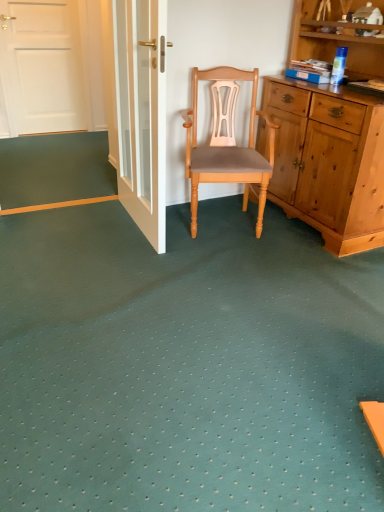
The width and height of the screenshot is (384, 512). Find the location of `free region on the left part of white glossy door at upper center`. free region on the left part of white glossy door at upper center is located at coordinates (75, 225).